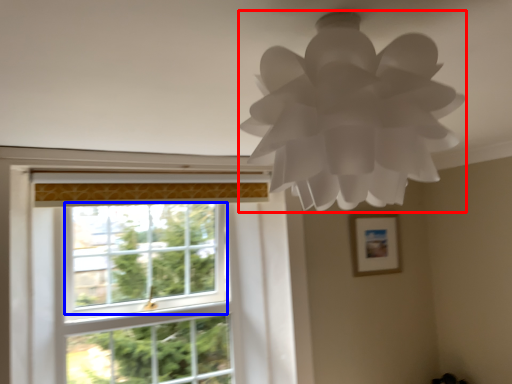
Question: Which point is closer to the camera, lamp (highlighted by a red box) or window screen (highlighted by a blue box)?

Choices:
 (A) lamp
 (B) window screen

Answer: (A)